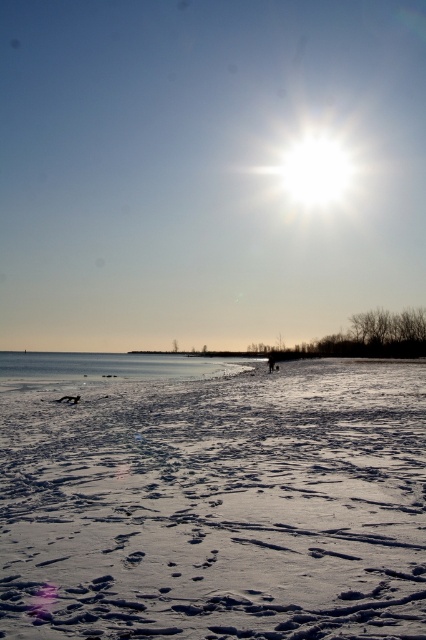
Question: Is white powdery snow at center smaller than clear ice lake at center?

Choices:
 (A) yes
 (B) no

Answer: (A)

Question: Among these points, which one is nearest to the camera?

Choices:
 (A) (311, 513)
 (B) (172, 356)

Answer: (A)

Question: Does white powdery snow at center appear over clear ice lake at center?

Choices:
 (A) no
 (B) yes

Answer: (B)

Question: Does white powdery snow at center have a lesser width compared to clear ice lake at center?

Choices:
 (A) no
 (B) yes

Answer: (B)